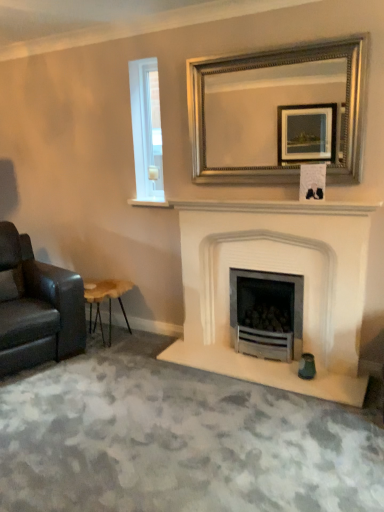
Where is `vacant region under white marble fireplace at center (from a real-world perspective)`? The width and height of the screenshot is (384, 512). vacant region under white marble fireplace at center (from a real-world perspective) is located at coordinates (259, 204).